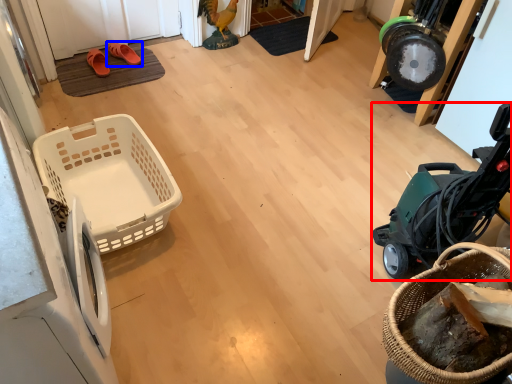
Question: Which point is further to the camera, baby carriage (highlighted by a red box) or footwear (highlighted by a blue box)?

Choices:
 (A) baby carriage
 (B) footwear

Answer: (B)